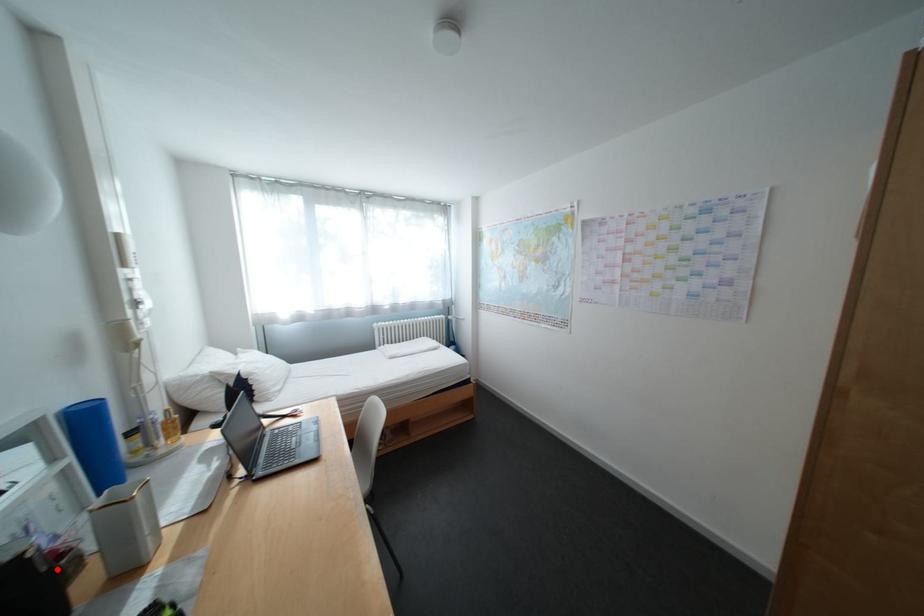
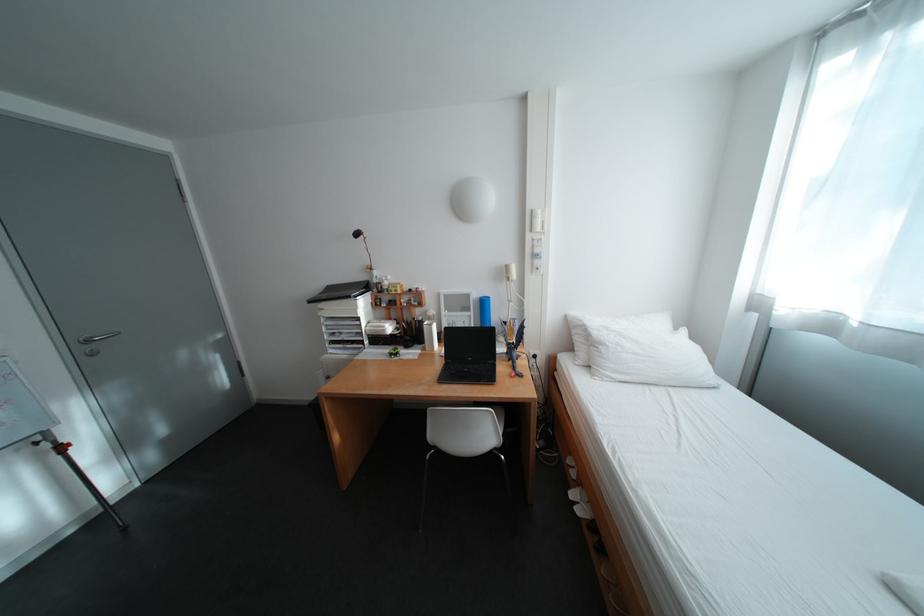
The point at the highlighted location is marked in the first image. Where is the corresponding point in the second image?

(430, 326)